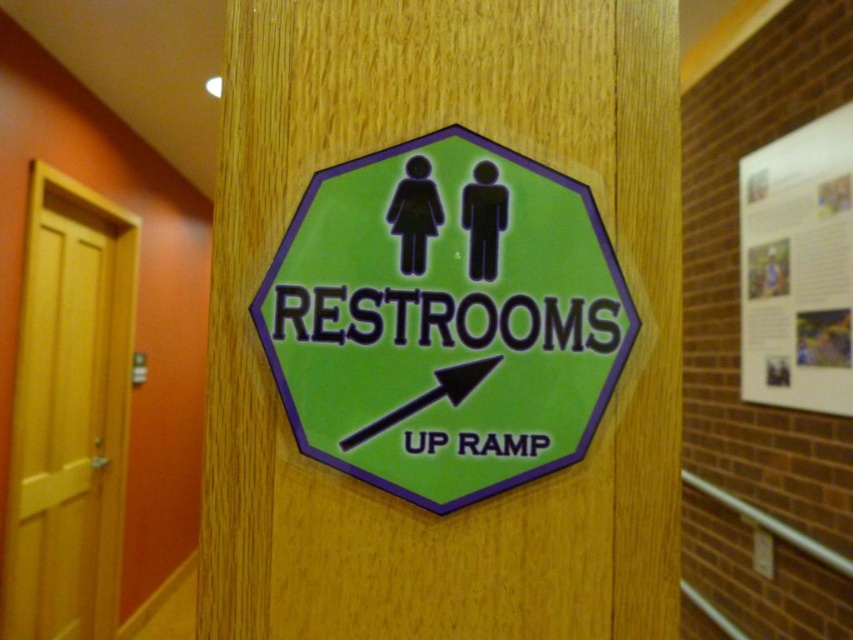
Question: Based on their relative distances, which object is farther from the white paper poster at upper right?

Choices:
 (A) yellow wood door at left
 (B) green plastic sign at center

Answer: (A)

Question: Does yellow wood door at left appear on the left side of white paper poster at upper right?

Choices:
 (A) no
 (B) yes

Answer: (B)

Question: Considering the real-world distances, which object is farthest from the yellow wood door at left?

Choices:
 (A) green plastic sign at center
 (B) white paper poster at upper right

Answer: (A)

Question: Does green plastic sign at center have a lesser width compared to yellow wood door at left?

Choices:
 (A) yes
 (B) no

Answer: (B)

Question: Does green plastic sign at center have a greater width compared to yellow wood door at left?

Choices:
 (A) no
 (B) yes

Answer: (B)

Question: Based on their relative distances, which object is nearer to the green plastic sign at center?

Choices:
 (A) yellow wood door at left
 (B) white paper poster at upper right

Answer: (B)